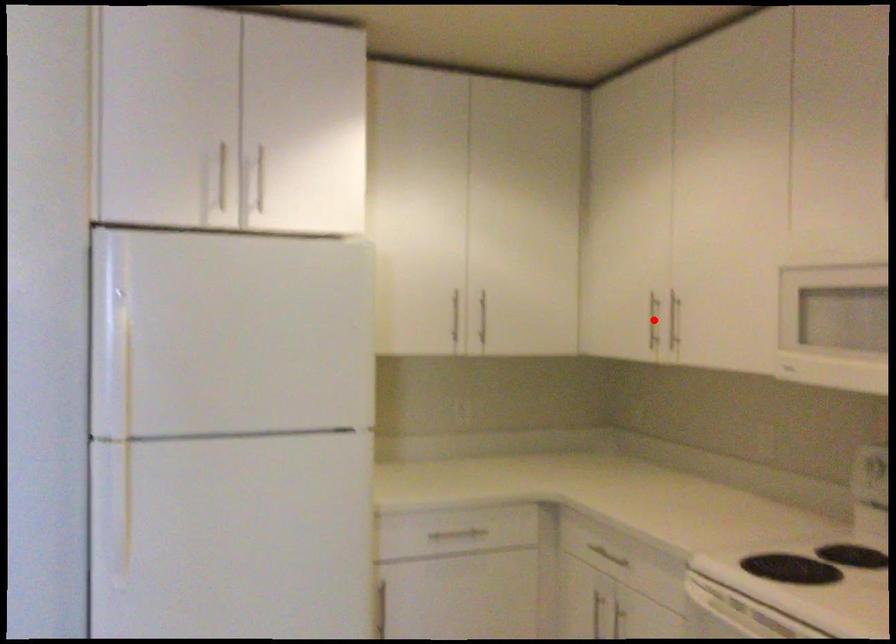
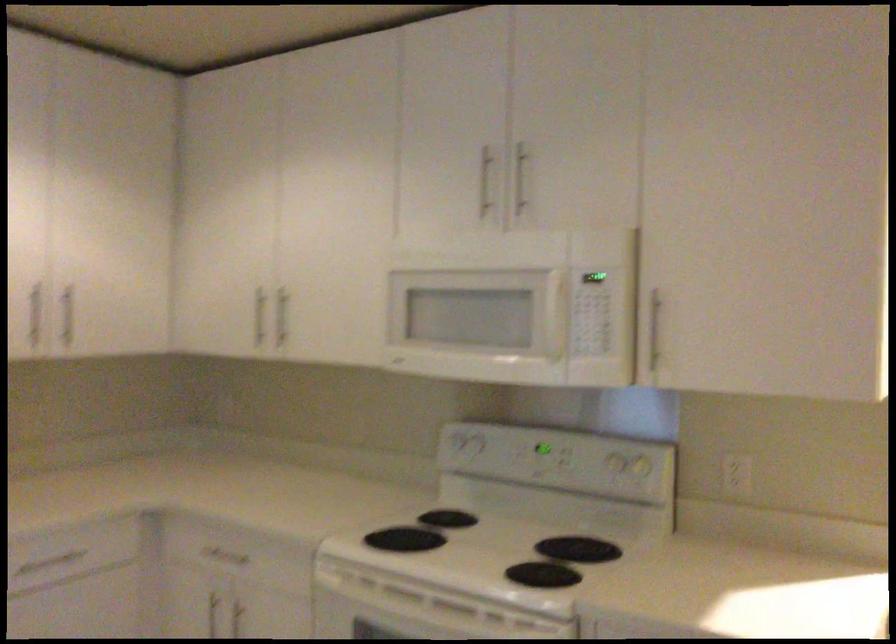
Where in the second image is the point corresponding to the highlighted location from the first image?

(259, 316)